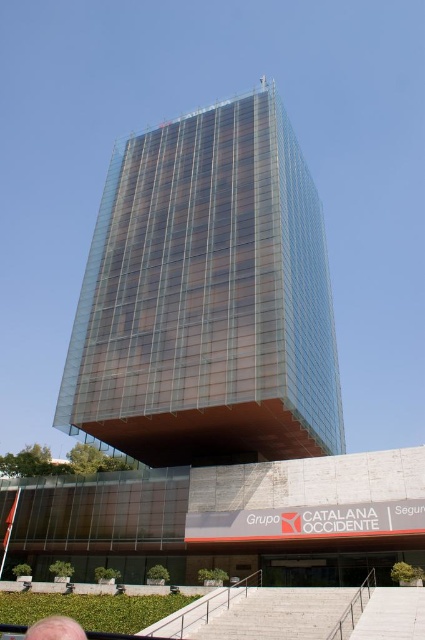
Is transparent glass tower at center shorter than blonde hair at lower left?

No.

This screenshot has height=640, width=425. What do you see at coordinates (207, 298) in the screenshot?
I see `transparent glass tower at center` at bounding box center [207, 298].

Find the location of a particular element. transparent glass tower at center is located at coordinates (207, 298).